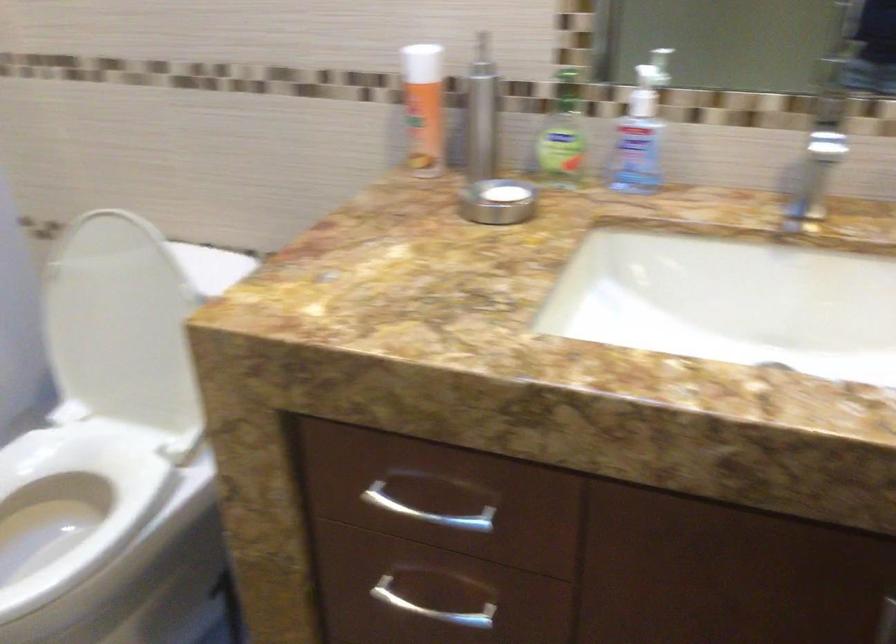
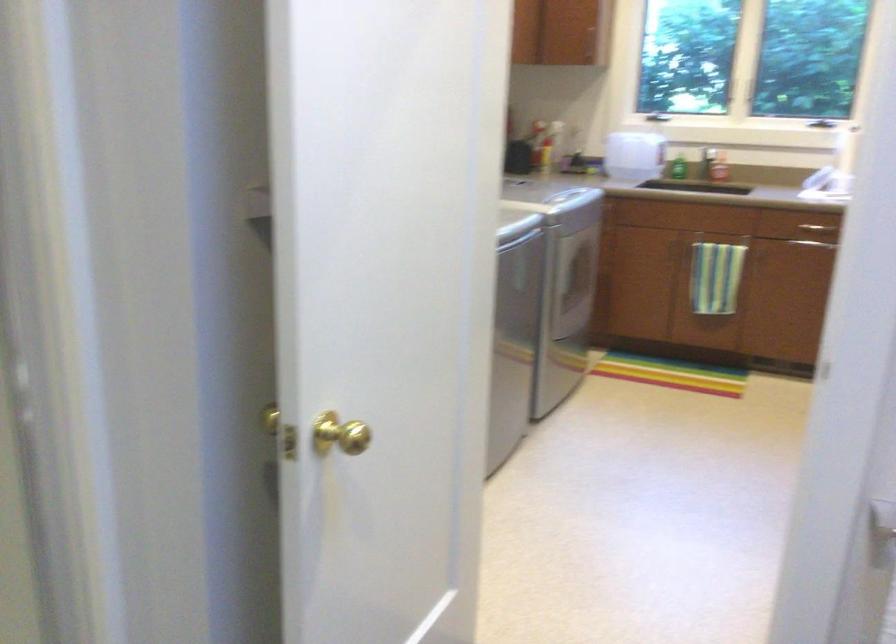
First-person continuous shooting, in which direction is the camera rotating?

The camera rotated toward left-down.